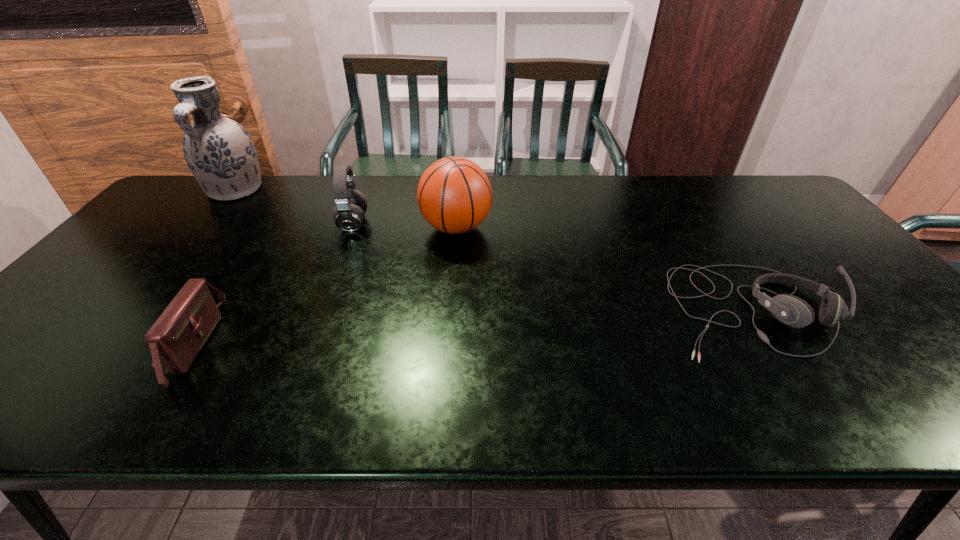
Locate an element on the screen. Image resolution: width=960 pixels, height=540 pixels. the leftmost object is located at coordinates (219, 152).

Locate an element on the screen. This screenshot has width=960, height=540. vase is located at coordinates (219, 152).

The width and height of the screenshot is (960, 540). In order to click on the second tallest object in this screenshot , I will do `click(454, 194)`.

Image resolution: width=960 pixels, height=540 pixels. In order to click on basketball in this screenshot , I will do `click(454, 194)`.

What are the coordinates of `the third object from right to left` in the screenshot? It's located at (349, 214).

Find the location of a particular element. The width and height of the screenshot is (960, 540). the third shortest object is located at coordinates (349, 214).

Locate an element on the screen. The width and height of the screenshot is (960, 540). the fourth tallest object is located at coordinates (175, 339).

The image size is (960, 540). Identify the location of the second object from left to right. (175, 339).

This screenshot has width=960, height=540. I want to click on the right headset, so click(x=791, y=310).

I want to click on the shortest object, so click(x=791, y=310).